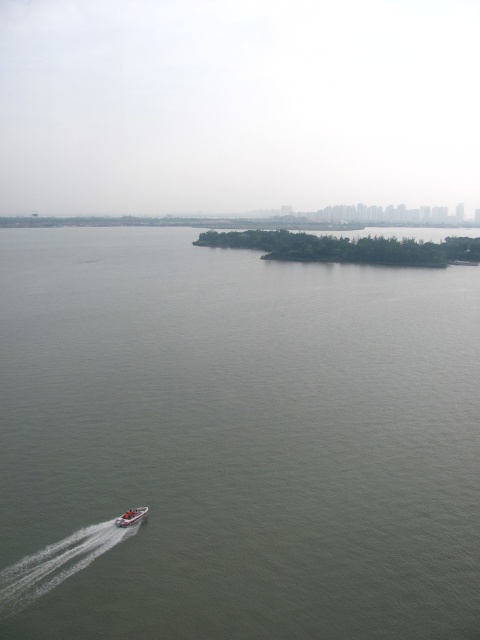
Question: Which point is farther to the camera?

Choices:
 (A) (232, 492)
 (B) (121, 525)

Answer: (A)

Question: Which point is farther to the camera?

Choices:
 (A) green water at center
 (B) white plastic boat at lower left

Answer: (B)

Question: From the image, what is the correct spatial relationship of green water at center in relation to white plastic boat at lower left?

Choices:
 (A) right
 (B) left

Answer: (A)

Question: Considering the relative positions of green water at center and white plastic boat at lower left in the image provided, where is green water at center located with respect to white plastic boat at lower left?

Choices:
 (A) above
 (B) below

Answer: (A)

Question: Does green water at center have a greater width compared to white plastic boat at lower left?

Choices:
 (A) yes
 (B) no

Answer: (A)